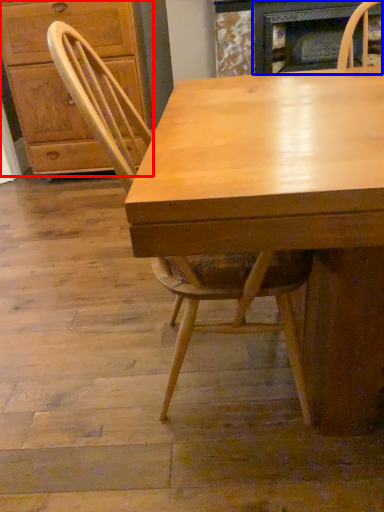
Question: Which object is closer to the camera taking this photo, cabinetry (highlighted by a red box) or fireplace (highlighted by a blue box)?

Choices:
 (A) cabinetry
 (B) fireplace

Answer: (B)